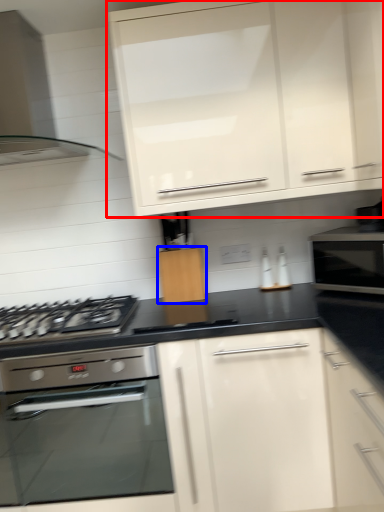
Question: Which point is further to the camera, cabinetry (highlighted by a red box) or cabinetry (highlighted by a blue box)?

Choices:
 (A) cabinetry
 (B) cabinetry

Answer: (B)